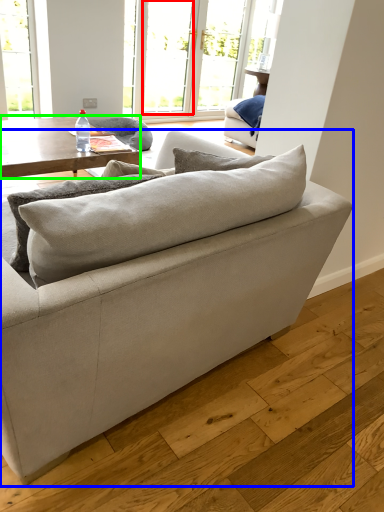
Question: Considering the real-world distances, which object is farthest from window (highlighted by a red box)? studio couch (highlighted by a blue box) or coffee table (highlighted by a green box)?

Choices:
 (A) studio couch
 (B) coffee table

Answer: (A)